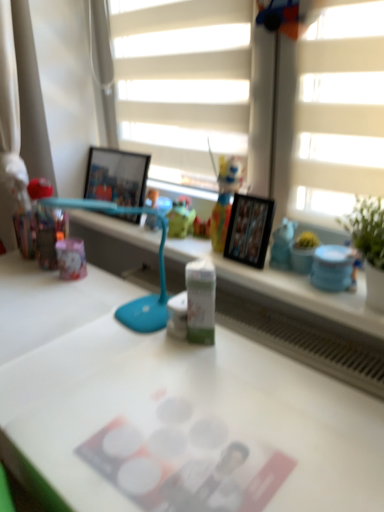
At what (x,y) coordinates should I click in order to perform the action: click on vacant space situated on the left part of green matte milk carton at center, placed as the 2th stationery when sorted from right to left. Please return your answer as a coordinate pair (x, y). Looking at the image, I should click on (130, 348).